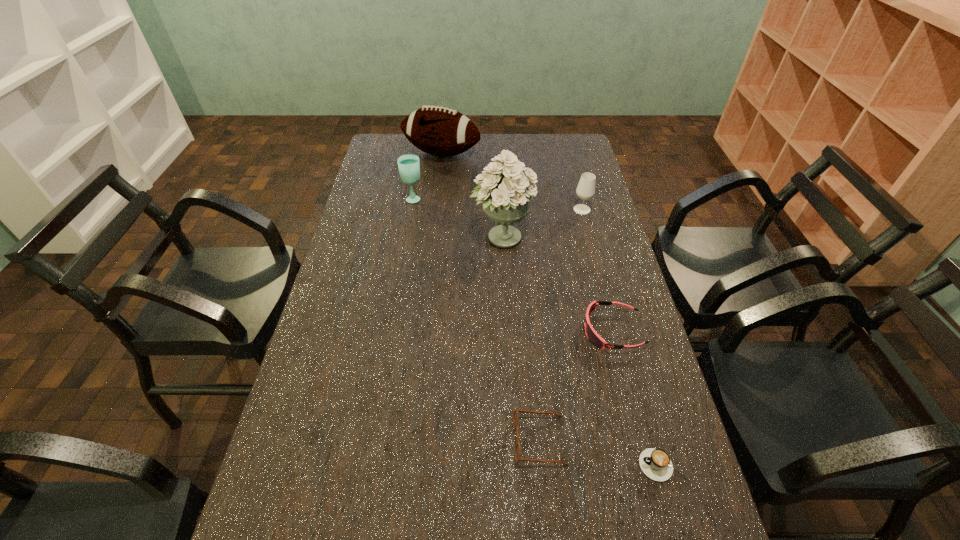
I want to click on spectacles, so click(x=517, y=450).

The image size is (960, 540). I want to click on cappuccino, so click(655, 463).

Find the location of a particular element. vacant space located on the right of the tallest object is located at coordinates (610, 238).

Locate an element on the screen. This screenshot has height=540, width=960. vacant area situated on the left of the second tallest object is located at coordinates (384, 154).

Find the location of a particular element. This screenshot has height=540, width=960. free location located on the left of the left glass is located at coordinates point(385,198).

The width and height of the screenshot is (960, 540). In order to click on vacant space located on the front of the fourth tallest object in this screenshot , I will do `click(600, 278)`.

Find the location of a particular element. vacant space located on the front-facing side of the goggles is located at coordinates (537, 331).

Find the location of a particular element. This screenshot has height=540, width=960. vacant area located 0.250m on the front-facing side of the goggles is located at coordinates (494, 331).

Where is `free location located 0.130m on the front-facing side of the goggles`? The image size is (960, 540). free location located 0.130m on the front-facing side of the goggles is located at coordinates (537, 331).

At what (x,y) coordinates should I click in order to perform the action: click on vacant space located on the front-facing side of the spectacles. Please return your answer as a coordinate pair (x, y). Looking at the image, I should click on (462, 440).